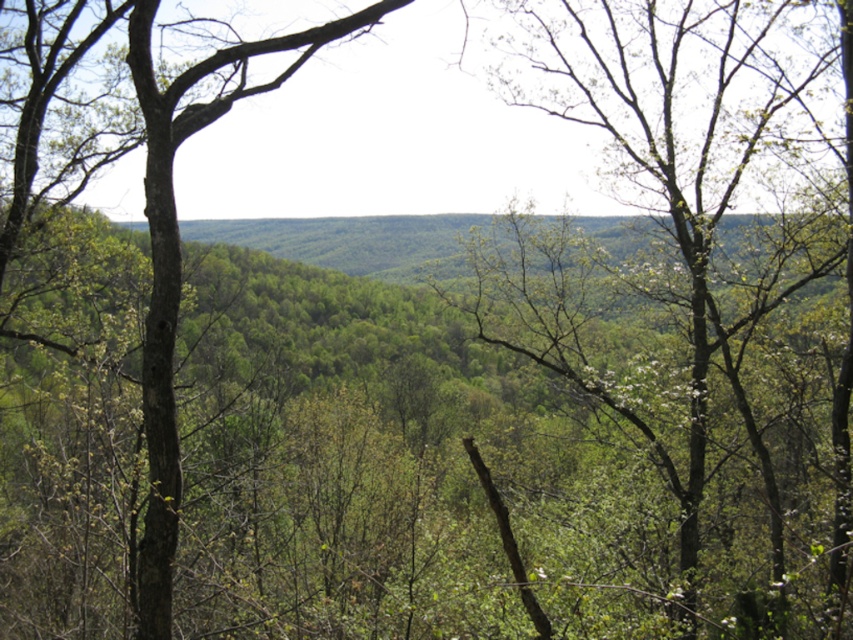
Consider the image. You are a hiker standing at the edge of the forest. You notice a green leafy tree at center and a green rough bark tree at left. Which tree would appear larger in your field of view?

The green leafy tree at center appears larger in your field of view because it is bigger than the green rough bark tree at left according to the description.

You are an observer standing at the edge of the forest. You notice a green leafy tree at center and a green rough bark tree at left. Which tree is closer to you?

The green leafy tree at center is closer because it is positioned in front of the green rough bark tree at left.

You are standing in the forest and want to walk from the green rough bark tree at left to the green leafy tree at center. Which direction should you move?

You should move to the right to reach the green leafy tree at center from the green rough bark tree at left since it is positioned to the right of it.